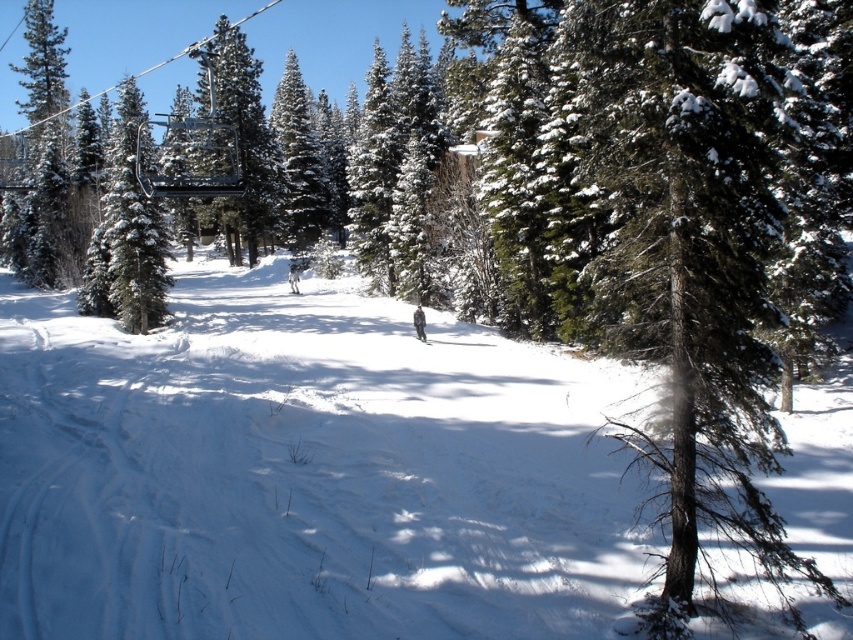
In the scene shown: You are a skier who wants to place your white matte ski at center between two green matte evergreen tree at center. Is there enough space between the two trees to fit the ski?

The green matte evergreen tree at center might be wider than the white matte ski at center, so there might not be enough space between the two trees to fit the ski.

You are a skier standing at the top of the slope and see the white snow at center and the white matte ski at center. Which object is closer to you?

The white snow at center is closer to the viewer than the white matte ski at center.

You are a photographer planning to capture the entire winter scene in one shot. Given that the white snow at center and the green matte evergreen tree at center are both in your frame, which object occupies a larger portion of the image horizontally?

The white snow at center occupies a larger horizontal portion of the image because its width surpasses that of the green matte evergreen tree at center.